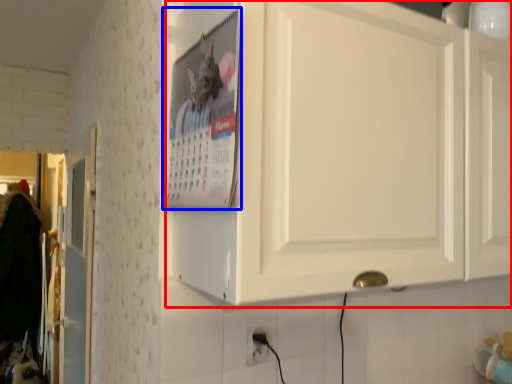
Question: Which point is further to the camera, cabinetry (highlighted by a red box) or poster page (highlighted by a blue box)?

Choices:
 (A) cabinetry
 (B) poster page

Answer: (B)